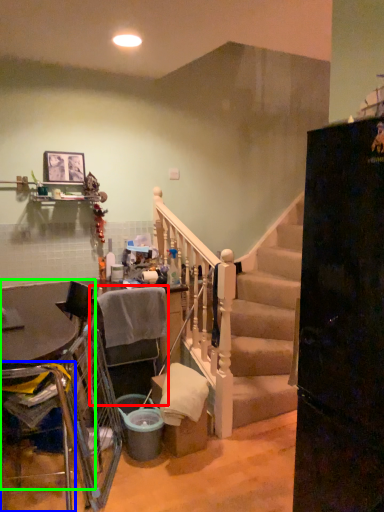
Question: Which object is the farthest from armchair (highlighted by a red box)? Choose among these: armchair (highlighted by a blue box) or table (highlighted by a green box).

Choices:
 (A) armchair
 (B) table

Answer: (A)